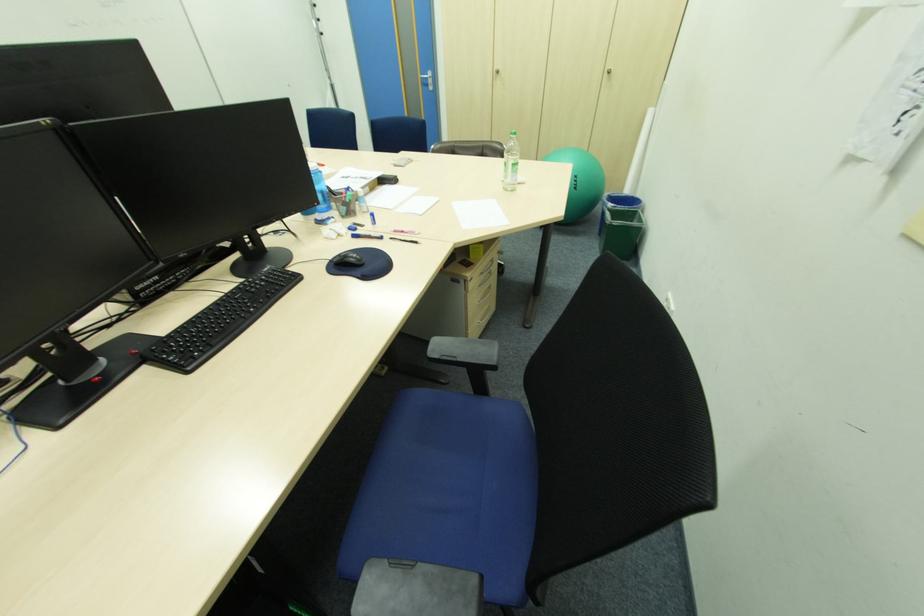
Image resolution: width=924 pixels, height=616 pixels. What do you see at coordinates (511, 161) in the screenshot?
I see `the clear water bottle` at bounding box center [511, 161].